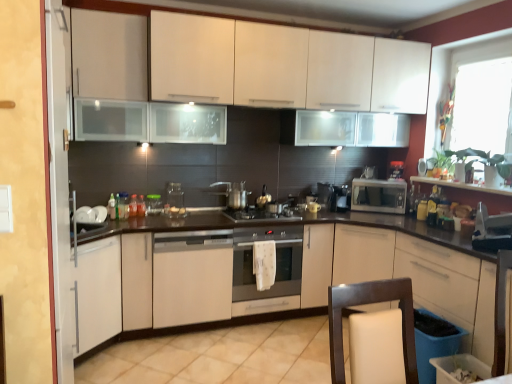
The width and height of the screenshot is (512, 384). What are the coordinates of `black stainless steel gas stove at center` in the screenshot? It's located at (260, 215).

This screenshot has height=384, width=512. What do you see at coordinates (260, 215) in the screenshot?
I see `black stainless steel gas stove at center` at bounding box center [260, 215].

Image resolution: width=512 pixels, height=384 pixels. Identify the location of satin silver microwave at right. (379, 196).

You are a GUI agent. You are given a task and a screenshot of the screen. Output one action in this format:
    pyautogui.click(x=<x>, y=<y>)
    Task: Click on the white matte cabinet at upper center, the 3th cabinetry when ordered from bottom to top
    The height and width of the screenshot is (384, 512).
    Given the screenshot: What is the action you would take?
    pyautogui.click(x=283, y=66)

Measure the distance between white matte dishwasher at center, positioned as the 1th home appliance in left-to-right order, and camera.

A distance of 3.04 meters exists between white matte dishwasher at center, positioned as the 1th home appliance in left-to-right order, and camera.

This screenshot has height=384, width=512. Describe the element at coordinates (192, 277) in the screenshot. I see `white matte dishwasher at center, positioned as the 1th home appliance in left-to-right order` at that location.

This screenshot has width=512, height=384. What do you see at coordinates (340, 199) in the screenshot?
I see `satin silver coffee maker at center, arranged as the 5th appliance when viewed from the left` at bounding box center [340, 199].

Measure the distance between translucent glass jar at center, placed as the 2th bottle when sorted from right to left, and camera.

The depth of translucent glass jar at center, placed as the 2th bottle when sorted from right to left, is 10.60 feet.

Image resolution: width=512 pixels, height=384 pixels. Find the location of `black stainless steel gas stove at center`. black stainless steel gas stove at center is located at coordinates (260, 215).

From the image's perspective, relative to matte white cabinet at center, the 3th cabinetry in the top-to-bottom sequence, is white glossy cabinet at left above or below?

Clearly, from the image's perspective, white glossy cabinet at left is above matte white cabinet at center, the 3th cabinetry in the top-to-bottom sequence.

Between white glossy cabinet at left and matte white cabinet at center, arranged as the 1th cabinetry when ordered from the bottom, which one has less height?

Standing shorter between the two is matte white cabinet at center, arranged as the 1th cabinetry when ordered from the bottom.

Which is more to the left, white glossy cabinet at left or matte white cabinet at center, the 3th cabinetry in the top-to-bottom sequence?

Positioned to the left is white glossy cabinet at left.

Can we say white glossy cabinet at left lies outside matte white cabinet at center, the 3th cabinetry in the top-to-bottom sequence?

Actually, white glossy cabinet at left is at least partially inside matte white cabinet at center, the 3th cabinetry in the top-to-bottom sequence.

Would you consider white glossy cabinet at left to be distant from white glossy microwave at upper right, the sixth appliance positioned from the left?

Yes.

Can you confirm if white glossy cabinet at left is wider than white glossy microwave at upper right, the sixth appliance positioned from the left?

No.

How much distance is there between white glossy cabinet at left and white glossy microwave at upper right, the sixth appliance positioned from the left?

They are 10.19 feet apart.

Could you tell me if white glossy cabinet at left is turned towards white glossy microwave at upper right, which is counted as the 3th appliance, starting from the right?

No, white glossy cabinet at left is not facing towards white glossy microwave at upper right, which is counted as the 3th appliance, starting from the right.

Does black stainless steel gas stove at center turn towards white matte cabinet at upper center, the 1th cabinetry from the top?

No, black stainless steel gas stove at center does not turn towards white matte cabinet at upper center, the 1th cabinetry from the top.

From the image's perspective, who appears lower, black stainless steel gas stove at center or white matte cabinet at upper center, the 3th cabinetry when ordered from bottom to top?

From the image's view, black stainless steel gas stove at center is below.

Does black stainless steel gas stove at center have a lesser width compared to white matte cabinet at upper center, the 1th cabinetry from the top?

Yes.

Where is `gas stove below the white matte cabinet at upper center, the 1th cabinetry from the top (from the image's perspective)`? gas stove below the white matte cabinet at upper center, the 1th cabinetry from the top (from the image's perspective) is located at coordinates (260, 215).

Is satin silver oven at center, which is counted as the first home appliance, starting from the right, aimed at satin black coffee maker at center, which is the 5th appliance from right to left?

No, satin silver oven at center, which is counted as the first home appliance, starting from the right, is not turned towards satin black coffee maker at center, which is the 5th appliance from right to left.

Can you confirm if satin silver oven at center, which is the second home appliance from left to right, is positioned to the right of satin black coffee maker at center, which appears as the fourth appliance when viewed from the left?

No.

From the satin black coffee maker at center, which is the 5th appliance from right to left, count the 1st home appliance to the left and point to it. Please provide its 2D coordinates.

[(276, 262)]

How many degrees apart are the facing directions of satin silver oven at center, which is counted as the first home appliance, starting from the right, and satin black coffee maker at center, which appears as the fourth appliance when viewed from the left?

The angle between the facing direction of satin silver oven at center, which is counted as the first home appliance, starting from the right, and the facing direction of satin black coffee maker at center, which appears as the fourth appliance when viewed from the left, is 1.25e-05 degrees.

Considering their positions, is satin silver kettle at center, the 2th appliance when ordered from left to right, located in front of or behind metallic silver toaster at right, the first appliance when ordered from right to left?

Visually, satin silver kettle at center, the 2th appliance when ordered from left to right, is located behind metallic silver toaster at right, the first appliance when ordered from right to left.

Does satin silver kettle at center, the seventh appliance from the right, have a lesser width compared to metallic silver toaster at right, arranged as the 8th appliance when viewed from the left?

Yes.

Is translucent glass jar at center, which is counted as the 1th bottle, starting from the left, wider than white matte cabinet at upper center, the 3th cabinetry when ordered from bottom to top?

In fact, translucent glass jar at center, which is counted as the 1th bottle, starting from the left, might be narrower than white matte cabinet at upper center, the 3th cabinetry when ordered from bottom to top.

From the image's perspective, between translucent glass jar at center, which is counted as the 1th bottle, starting from the left, and white matte cabinet at upper center, the 3th cabinetry when ordered from bottom to top, who is located below?

translucent glass jar at center, which is counted as the 1th bottle, starting from the left.

You are a GUI agent. You are given a task and a screenshot of the screen. Output one action in this format:
    pyautogui.click(x=<x>, y=<y>)
    Task: Click on the 2nd cabinetry to the right of the translucent glass jar at center, which is counted as the 1th bottle, starting from the left, counting from the anchor's position
    This screenshot has width=512, height=384.
    Given the screenshot: What is the action you would take?
    pyautogui.click(x=283, y=66)

Consider the image. Does translucent glass jar at center, which is counted as the 1th bottle, starting from the left, touch white matte cabinet at upper center, the 1th cabinetry from the top?

They are not placed beside each other.

Considering the sizes of objects transparent glass window at upper right and satin silver kettle at center, the sixth appliance in the right-to-left sequence, in the image provided, who is shorter, transparent glass window at upper right or satin silver kettle at center, the sixth appliance in the right-to-left sequence,?

satin silver kettle at center, the sixth appliance in the right-to-left sequence, is shorter.

From a real-world perspective, which object stands above the other?

transparent glass window at upper right.

Between transparent glass window at upper right and satin silver kettle at center, the sixth appliance in the right-to-left sequence, which one has smaller size?

satin silver kettle at center, the sixth appliance in the right-to-left sequence, is smaller.

Identify the location of screen door that is on the left side of matte white cabinet at center, the 3th cabinetry in the top-to-bottom sequence. Image resolution: width=512 pixels, height=384 pixels. (59, 187).

This screenshot has height=384, width=512. I want to click on screen door located underneath the white glossy microwave at upper right, which is counted as the 3th appliance, starting from the right (from a real-world perspective), so click(59, 187).

Looking at the image, which one is located further to satin silver coffee maker at center, the 4th appliance when ordered from right to left, satin silver oven at center, which is the second home appliance from left to right, or transparent glass jar at center, which is counted as the 1th appliance, starting from the left?

transparent glass jar at center, which is counted as the 1th appliance, starting from the left.

Looking at the image, which one is located closer to translucent glass bottle at center, acting as the second bottle starting from the left, satin silver microwave at right or satin silver kettle at center, the 2th appliance when ordered from left to right?

satin silver kettle at center, the 2th appliance when ordered from left to right, is positioned closer to the anchor translucent glass bottle at center, acting as the second bottle starting from the left.

When comparing their distances from white matte cabinet at upper center, the 1th cabinetry from the top, does metallic silver toaster at right, arranged as the 8th appliance when viewed from the left, or satin silver microwave at right seem further?

metallic silver toaster at right, arranged as the 8th appliance when viewed from the left, is positioned further to the anchor white matte cabinet at upper center, the 1th cabinetry from the top.

Which object lies further to the anchor point translucent glass bottle at center, acting as the second bottle starting from the left, metallic silver microwave at right, acting as the 2th appliance starting from the right, or satin silver oven at center, which is the second home appliance from left to right?

The object further to translucent glass bottle at center, acting as the second bottle starting from the left, is metallic silver microwave at right, acting as the 2th appliance starting from the right.

When comparing their distances from satin silver kettle at center, the seventh appliance from the right, does satin black coffee maker at center, which appears as the fourth appliance when viewed from the left, or white matte cabinet at upper center, the 3th cabinetry when ordered from bottom to top, seem further?

white matte cabinet at upper center, the 3th cabinetry when ordered from bottom to top, is positioned further to the anchor satin silver kettle at center, the seventh appliance from the right.

Based on their spatial positions, is satin silver kettle at center, the 3th appliance in the left-to-right sequence, or satin silver microwave at right further from translucent glass bottle at center, acting as the 1th bottle starting from the right?

Among the two, satin silver microwave at right is located further to translucent glass bottle at center, acting as the 1th bottle starting from the right.

Looking at the image, which one is located closer to matte white cabinet at center, the 3th cabinetry in the top-to-bottom sequence, satin silver oven at center, which is the second home appliance from left to right, or transparent glass window at upper right?

satin silver oven at center, which is the second home appliance from left to right.

Estimate the real-world distances between objects in this image. Which object is closer to transparent glass jar at center, which is counted as the eighth appliance, starting from the right, satin silver oven at center, which is counted as the first home appliance, starting from the right, or metallic silver toaster at right, arranged as the 8th appliance when viewed from the left?

Based on the image, satin silver oven at center, which is counted as the first home appliance, starting from the right, appears to be nearer to transparent glass jar at center, which is counted as the eighth appliance, starting from the right.

The width and height of the screenshot is (512, 384). I want to click on microwave oven between satin black coffee maker at center, which is the 5th appliance from right to left, and transparent glass window at upper right from left to right, so click(379, 196).

You are a GUI agent. You are given a task and a screenshot of the screen. Output one action in this format:
    pyautogui.click(x=<x>, y=<y>)
    Task: Click on the gas stove between translucent glass bottle at center, acting as the second bottle starting from the left, and white glossy microwave at upper right, which is counted as the 3th appliance, starting from the right, in the horizontal direction
    The height and width of the screenshot is (384, 512).
    Given the screenshot: What is the action you would take?
    pyautogui.click(x=260, y=215)

Image resolution: width=512 pixels, height=384 pixels. Find the location of `gas stove between white matte cabinet at upper center, the 3th cabinetry when ordered from bottom to top, and white matte cabinet at left, which is the 2th cabinetry in bottom-to-top order, vertically`. gas stove between white matte cabinet at upper center, the 3th cabinetry when ordered from bottom to top, and white matte cabinet at left, which is the 2th cabinetry in bottom-to-top order, vertically is located at coordinates (260, 215).

Locate an element on the screen. The width and height of the screenshot is (512, 384). microwave oven between matte white cabinet at center, arranged as the 1th cabinetry when ordered from the bottom, and metallic silver microwave at right, which is the 7th appliance in left-to-right order, along the z-axis is located at coordinates (379, 196).